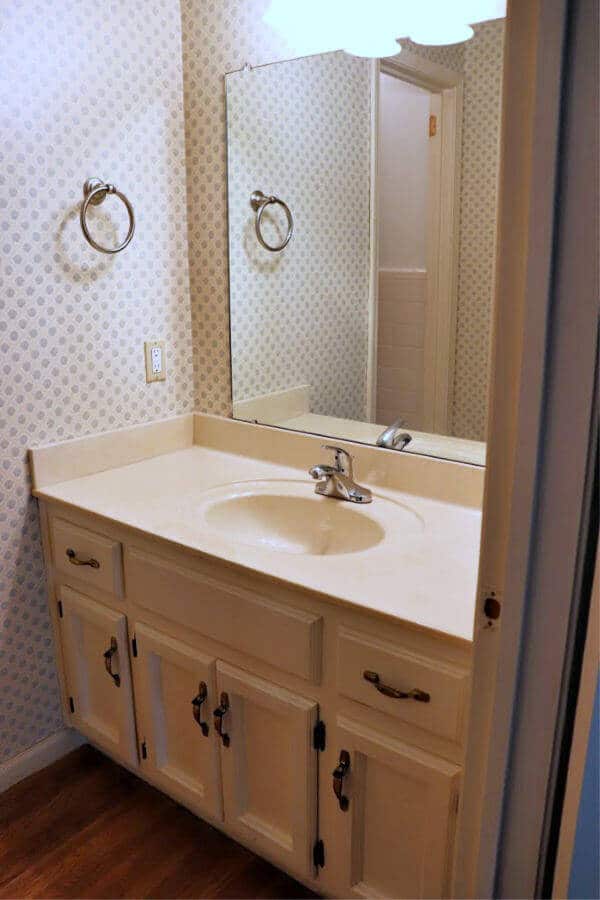
What are the coordinates of `white door stop` in the screenshot? It's located at (507, 634).